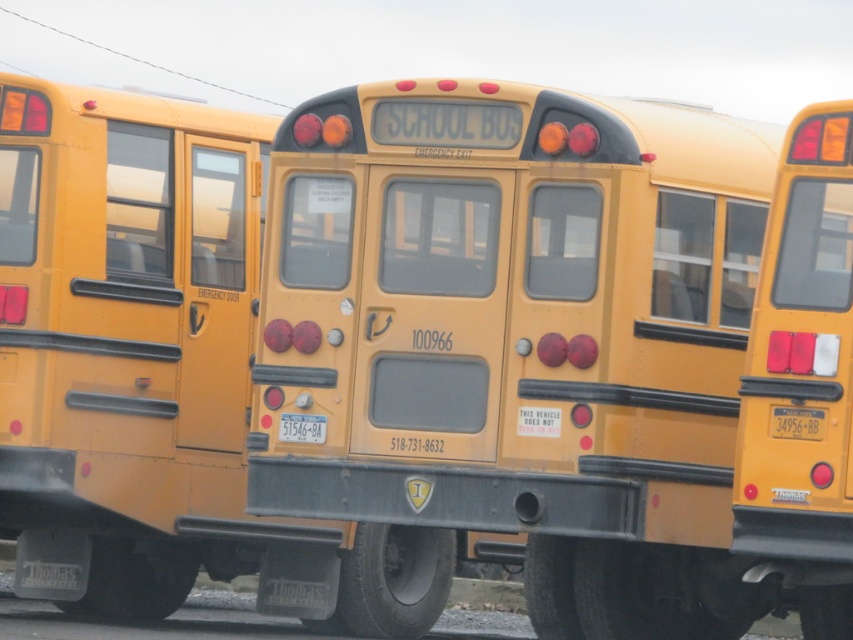
Does yellow matte/solid school bus at center appear on the right side of yellow matte license plate at center?

Indeed, yellow matte/solid school bus at center is positioned on the right side of yellow matte license plate at center.

Who is taller, yellow matte/solid school bus at center or yellow matte license plate at center?

With more height is yellow matte/solid school bus at center.

Find the location of a particular element. This screenshot has height=640, width=853. yellow matte/solid school bus at center is located at coordinates (521, 337).

From the picture: Is yellow matte/solid school bus at center taller than yellow plastic license plate at center?

Indeed, yellow matte/solid school bus at center has a greater height compared to yellow plastic license plate at center.

Between yellow matte/solid school bus at center and yellow plastic license plate at center, which one appears on the right side from the viewer's perspective?

yellow plastic license plate at center is more to the right.

Measure the distance between yellow matte/solid school bus at center and camera.

9.10 meters

The image size is (853, 640). In order to click on yellow matte/solid school bus at center in this screenshot , I will do `click(521, 337)`.

Locate an element on the screen. The height and width of the screenshot is (640, 853). yellow plastic license plate at center is located at coordinates (798, 422).

In the scene shown: Between yellow plastic license plate at center and yellow matte license plate at center, which one appears on the right side from the viewer's perspective?

yellow plastic license plate at center is more to the right.

Find the location of a particular element. The image size is (853, 640). yellow plastic license plate at center is located at coordinates (798, 422).